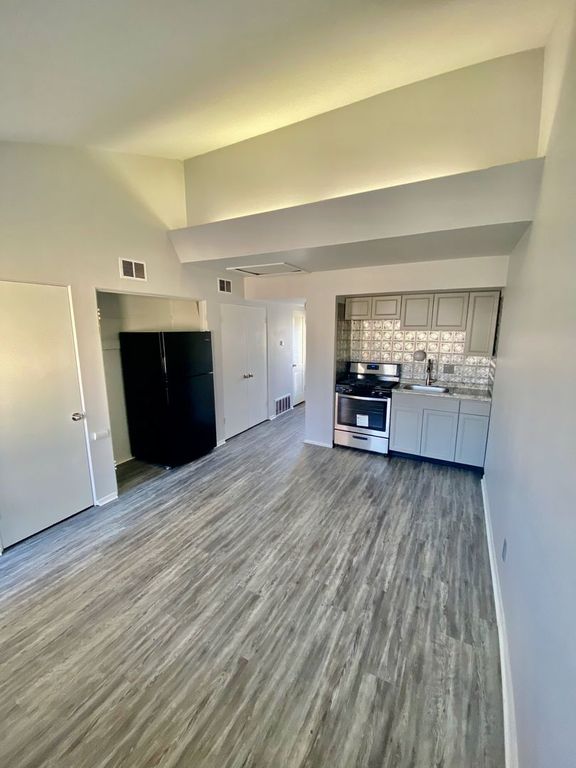
Identify the location of refrigerator. (166, 408).